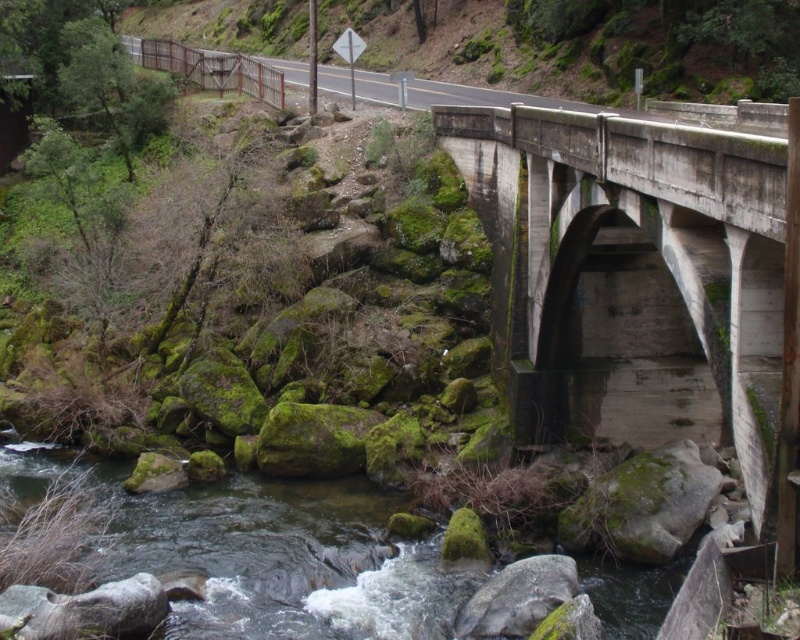
Is concrete at center in front of green mossy rocks at upper left?

Yes, concrete at center is closer to the viewer.

Does concrete at center have a greater height compared to green mossy rocks at upper left?

No.

At what (x,y) coordinates should I click in order to perform the action: click on concrete at center. Please return your answer as a coordinate pair (x, y). Looking at the image, I should click on (644, 278).

Does concrete at center have a greater height compared to green mossy rocks at lower center?

Indeed, concrete at center has a greater height compared to green mossy rocks at lower center.

The image size is (800, 640). Describe the element at coordinates (644, 278) in the screenshot. I see `concrete at center` at that location.

Does point (740, 176) come farther from viewer compared to point (358, 632)?

No, (740, 176) is closer to viewer.

Find the location of `concrete at center`. concrete at center is located at coordinates (644, 278).

Which of these two, green mossy rocks at lower center or green mossy rocks at upper left, stands shorter?

green mossy rocks at lower center is shorter.

Is point (416, 552) behind point (249, 35)?

No, it is in front of (249, 35).

The height and width of the screenshot is (640, 800). What are the coordinates of `green mossy rocks at lower center` in the screenshot? It's located at 288,561.